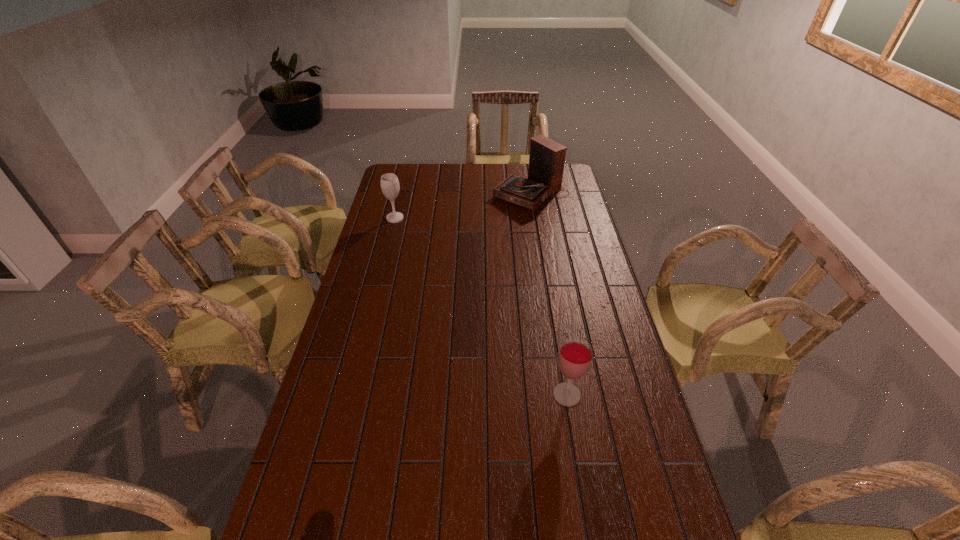
Locate an element on the screen. The height and width of the screenshot is (540, 960). free space between the nearer wineglass and the left wineglass is located at coordinates (481, 306).

Point out which object is positioned as the second nearest to the second nearest object. Please provide its 2D coordinates. Your answer should be formatted as a tuple, i.e. [(x, y)], where the tuple contains the x and y coordinates of a point satisfying the conditions above.

[(575, 356)]

Identify which object is located as the nearest to the left wineglass. Please provide its 2D coordinates. Your answer should be formatted as a tuple, i.e. [(x, y)], where the tuple contains the x and y coordinates of a point satisfying the conditions above.

[(546, 160)]